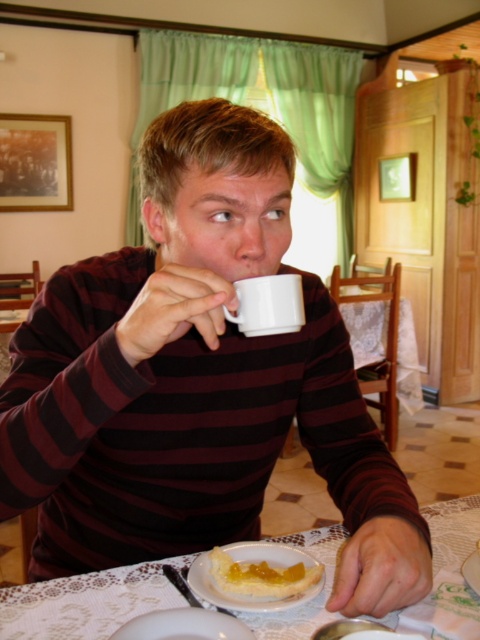
You are a server at a restaurant and need to place a new dessert plate on the table. The table currently has a white lace tablecloth at lower center and a white glossy plate at lower center. Where should you place the new dessert plate so it is visible to the customer?

The white glossy plate at lower center is behind the white lace tablecloth at lower center, so placing the new dessert plate in front of the white lace tablecloth at lower center would make it visible to the customer.

Please provide the coordinates of the white lace tablecloth at lower center in the image. The coordinate system is normalized, with the origin at the bottom left corner of the image. The x and y axes are measured in meters. The coordinates are given as a tuple of two numbers, rounded to three decimal places.

The coordinates of the white lace tablecloth at lower center are at point (85, 602).

You are a server in a restaurant and need to place a new dessert order on the table. The table has a white lace tablecloth at lower center and a yellow custard tart at lower center. Can you fit the dessert plate, which is 4 inches in diameter, between them without overlapping?

The distance between the white lace tablecloth at lower center and the yellow custard tart at lower center is 4.18 inches. Since the dessert plate is 4 inches in diameter, it can fit between them without overlapping as there is enough space.